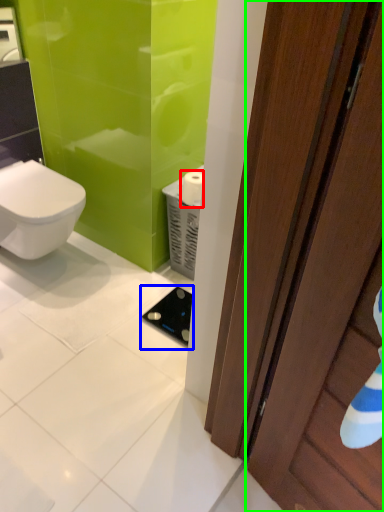
Question: Which is farther away from toilet paper (highlighted by a red box)? appliance (highlighted by a blue box) or door (highlighted by a green box)?

Choices:
 (A) appliance
 (B) door

Answer: (B)